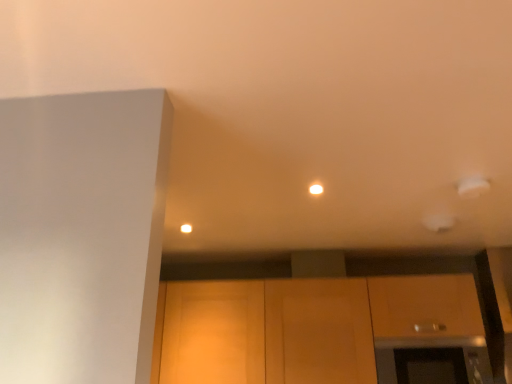
Question: In terms of width, does black glass oven at lower right look wider or thinner when compared to matte wood cabinetry at lower center?

Choices:
 (A) wide
 (B) thin

Answer: (B)

Question: Relative to matte wood cabinetry at lower center, is black glass oven at lower right in front or behind?

Choices:
 (A) behind
 (B) front

Answer: (B)

Question: From a real-world perspective, relative to matte wood cabinetry at lower center, is black glass oven at lower right vertically above or below?

Choices:
 (A) below
 (B) above

Answer: (A)

Question: Based on their sizes in the image, would you say matte wood cabinetry at lower center is bigger or smaller than black glass oven at lower right?

Choices:
 (A) small
 (B) big

Answer: (B)

Question: Based on their positions, is matte wood cabinetry at lower center located to the left or right of black glass oven at lower right?

Choices:
 (A) left
 (B) right

Answer: (A)

Question: Is matte wood cabinetry at lower center wider or thinner than black glass oven at lower right?

Choices:
 (A) thin
 (B) wide

Answer: (B)

Question: Does point (320, 322) appear closer or farther from the camera than point (473, 374)?

Choices:
 (A) closer
 (B) farther

Answer: (B)